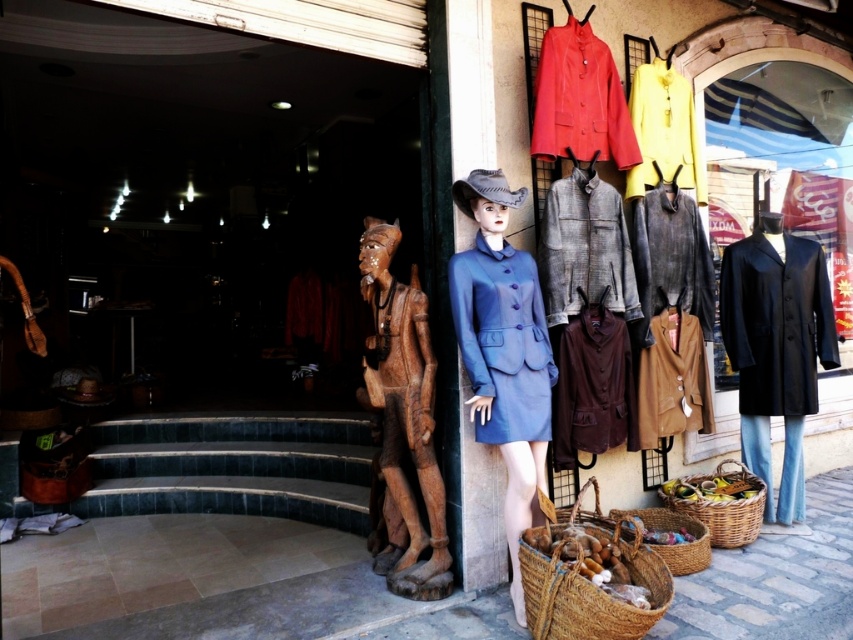
Question: Can you confirm if brown leather jacket at center is smaller than leather coat at center?

Choices:
 (A) no
 (B) yes

Answer: (B)

Question: Estimate the real-world distances between objects in this image. Which object is farther from the wooden statue at center?

Choices:
 (A) woven brown basket at lower right
 (B) matte brown coat at center
 (C) yellow wool coat at upper right
 (D) matte blue fabric coat at center

Answer: (C)

Question: Can you confirm if gray woolen coat at center is positioned to the right of leather coat at center?

Choices:
 (A) no
 (B) yes

Answer: (A)

Question: Which object is the closest to the brown leather jacket at center?

Choices:
 (A) matte black coat at right
 (B) woven brown basket at lower center
 (C) yellow wool coat at upper right
 (D) gray woolen coat at center

Answer: (D)

Question: Does matte red coat at upper center appear on the right side of leather coat at center?

Choices:
 (A) no
 (B) yes

Answer: (A)

Question: Estimate the real-world distances between objects in this image. Which object is closer to the matte blue fabric coat at center?

Choices:
 (A) brown woven basket at lower center
 (B) woven brown basket at lower center

Answer: (A)